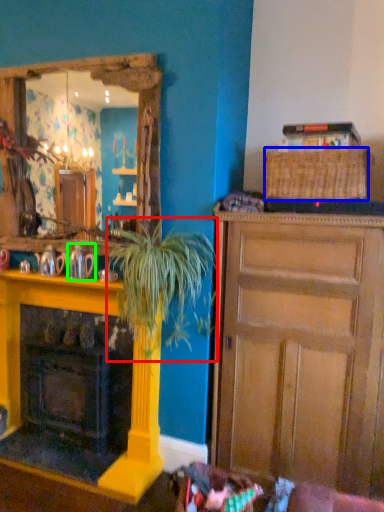
Question: Which is nearer to the houseplant (highlighted by a red box)? picnic basket (highlighted by a blue box) or teapot (highlighted by a green box).

Choices:
 (A) picnic basket
 (B) teapot

Answer: (B)